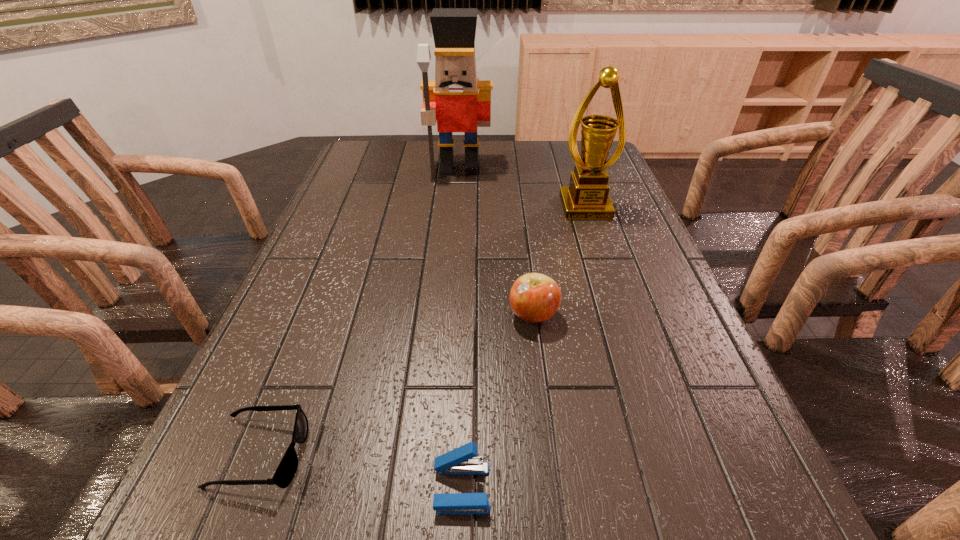
At what (x,y) coordinates should I click in order to perform the action: click on nutcracker. Please return your answer as a coordinate pair (x, y). Looking at the image, I should click on (459, 102).

This screenshot has width=960, height=540. I want to click on the second tallest object, so click(587, 197).

The width and height of the screenshot is (960, 540). I want to click on the rightmost object, so click(587, 197).

Identify the location of the third shortest object. Image resolution: width=960 pixels, height=540 pixels. (534, 297).

I want to click on the third farthest object, so click(x=534, y=297).

Locate an element on the screen. This screenshot has height=540, width=960. stapler is located at coordinates (461, 461).

I want to click on the shortest object, so click(x=286, y=470).

Identify the location of the leftmost object. (286, 470).

Locate an element on the screen. This screenshot has width=960, height=540. vacant space situated in front of the nutcracker holding the staff is located at coordinates (455, 230).

At what (x,y) coordinates should I click in order to perform the action: click on free space located 0.120m on the front-facing side of the rightmost object. Please return your answer as a coordinate pair (x, y). The width and height of the screenshot is (960, 540). Looking at the image, I should click on (598, 247).